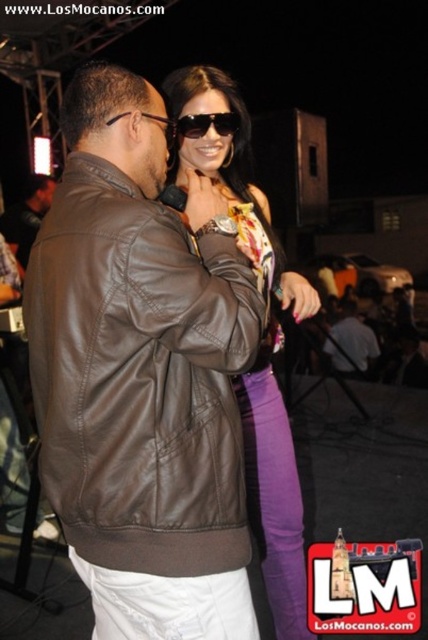
Is point (279, 484) closer to viewer compared to point (350, 305)?

Yes, it is in front of point (350, 305).

From the picture: Which of these two, shiny purple jeans at center or dark brown leather jacket at center, stands shorter?

With less height is dark brown leather jacket at center.

Locate an element on the screen. The height and width of the screenshot is (640, 428). shiny purple jeans at center is located at coordinates (261, 342).

Is brown leather jacket at left to the right of black plastic sunglasses at upper center from the viewer's perspective?

No, brown leather jacket at left is not to the right of black plastic sunglasses at upper center.

Consider the image. Which of these two, brown leather jacket at left or black plastic sunglasses at upper center, stands taller?

With more height is brown leather jacket at left.

Is point (33, 253) farther from camera compared to point (187, 131)?

No, (33, 253) is in front of (187, 131).

Identify the location of brown leather jacket at left. pyautogui.click(x=139, y=376).

Which is behind, point (53, 396) or point (275, 502)?

The point (275, 502) is more distant.

Does brown leather jacket at left have a smaller size compared to shiny purple jeans at center?

Yes, brown leather jacket at left is smaller than shiny purple jeans at center.

Which is in front, point (115, 330) or point (253, 221)?

Point (115, 330)

You are a GUI agent. You are given a task and a screenshot of the screen. Output one action in this format:
    pyautogui.click(x=<x>, y=<y>)
    Task: Click on the brown leather jacket at left
    
    Given the screenshot: What is the action you would take?
    pyautogui.click(x=139, y=376)